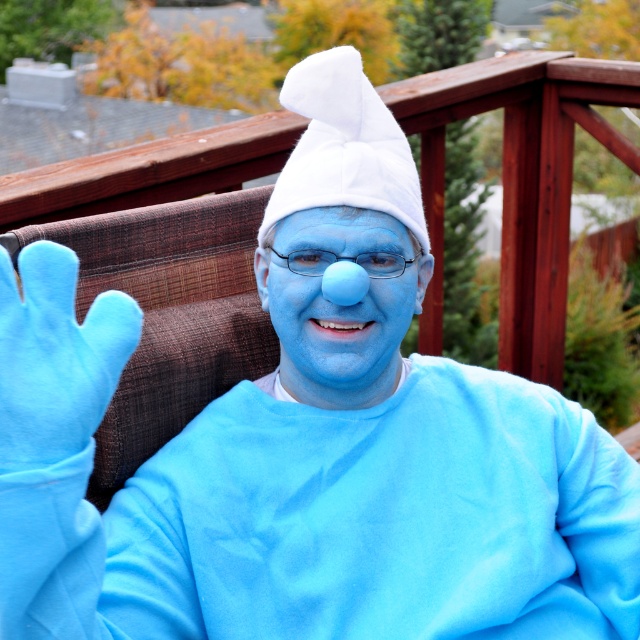
Can you confirm if fuzzy blue glove at left is bigger than matte blue nose at center?

No, fuzzy blue glove at left is not bigger than matte blue nose at center.

Based on the photo, who is positioned more to the right, fuzzy blue glove at left or matte blue nose at center?

matte blue nose at center is more to the right.

I want to click on fuzzy blue glove at left, so click(x=54, y=356).